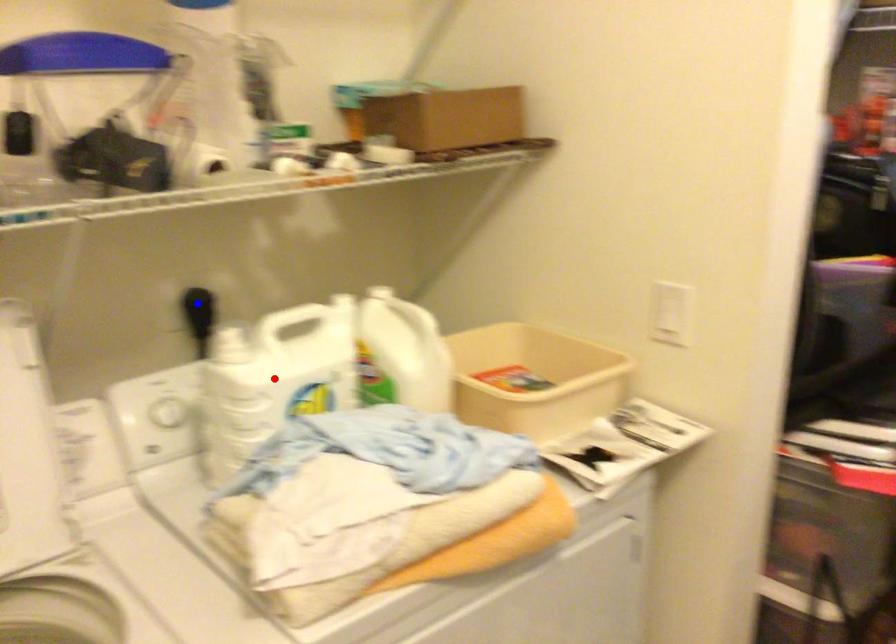
Question: Which of the two points in the image is closer to the camera?

Choices:
 (A) Blue point is closer.
 (B) Red point is closer.

Answer: (B)